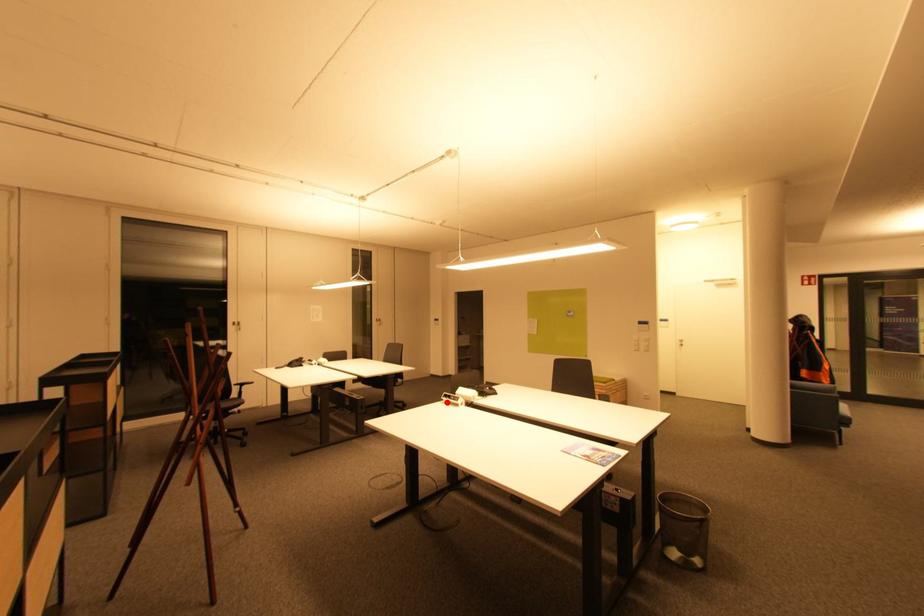
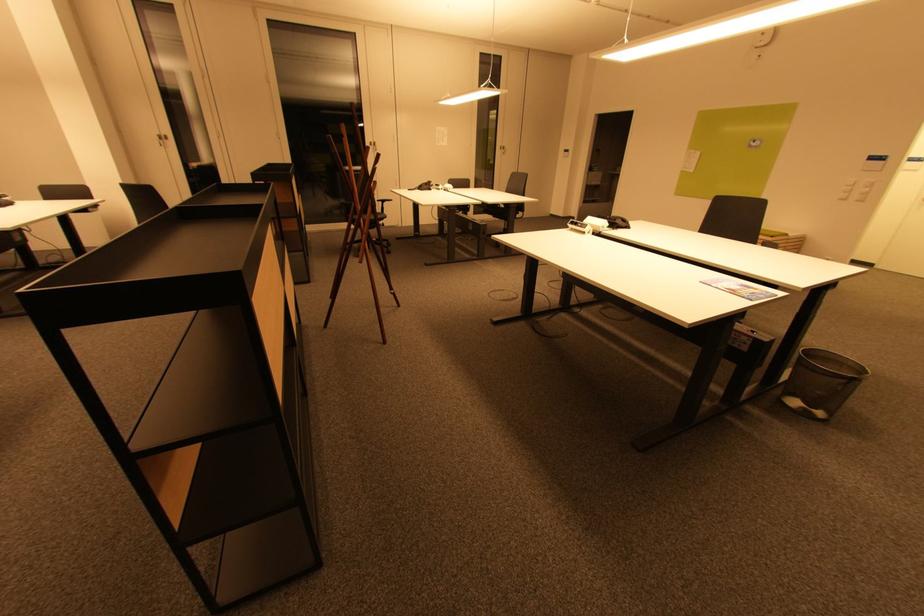
The point at the highlighted location is marked in the first image. Where is the corresponding point in the second image?

(572, 229)